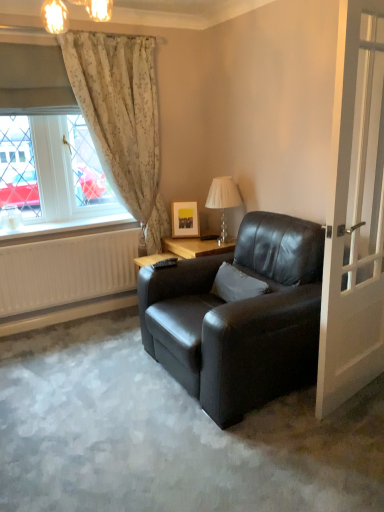
Question: Is white glossy door at right positioned behind translucent glass table lamp at upper center?

Choices:
 (A) yes
 (B) no

Answer: (B)

Question: Is translucent glass table lamp at upper center at the back of white glossy door at right?

Choices:
 (A) yes
 (B) no

Answer: (A)

Question: Is white glossy door at right at the left side of translucent glass table lamp at upper center?

Choices:
 (A) no
 (B) yes

Answer: (A)

Question: Are white glossy door at right and translucent glass table lamp at upper center beside each other?

Choices:
 (A) yes
 (B) no

Answer: (B)

Question: Can you confirm if white glossy door at right is shorter than translucent glass table lamp at upper center?

Choices:
 (A) yes
 (B) no

Answer: (B)

Question: Is white glossy door at right outside of translucent glass table lamp at upper center?

Choices:
 (A) yes
 (B) no

Answer: (A)

Question: Can we say white soft pillow at center lies outside white glossy door at right?

Choices:
 (A) yes
 (B) no

Answer: (A)

Question: Is white soft pillow at center bigger than white glossy door at right?

Choices:
 (A) yes
 (B) no

Answer: (B)

Question: From a real-world perspective, is white soft pillow at center on top of white glossy door at right?

Choices:
 (A) no
 (B) yes

Answer: (A)

Question: Is white soft pillow at center shorter than white glossy door at right?

Choices:
 (A) yes
 (B) no

Answer: (A)

Question: Does white soft pillow at center have a lesser width compared to white glossy door at right?

Choices:
 (A) yes
 (B) no

Answer: (B)

Question: Considering the relative sizes of white soft pillow at center and white glossy door at right in the image provided, is white soft pillow at center smaller than white glossy door at right?

Choices:
 (A) yes
 (B) no

Answer: (A)

Question: Is white glossy door at right placed right next to matte black armchair at center?

Choices:
 (A) no
 (B) yes

Answer: (A)